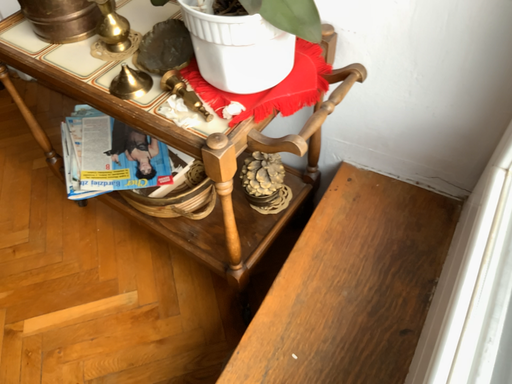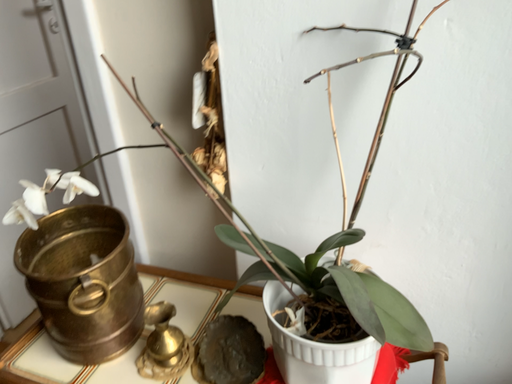
Question: Which way did the camera rotate in the video?

Choices:
 (A) rotated left
 (B) rotated right

Answer: (B)